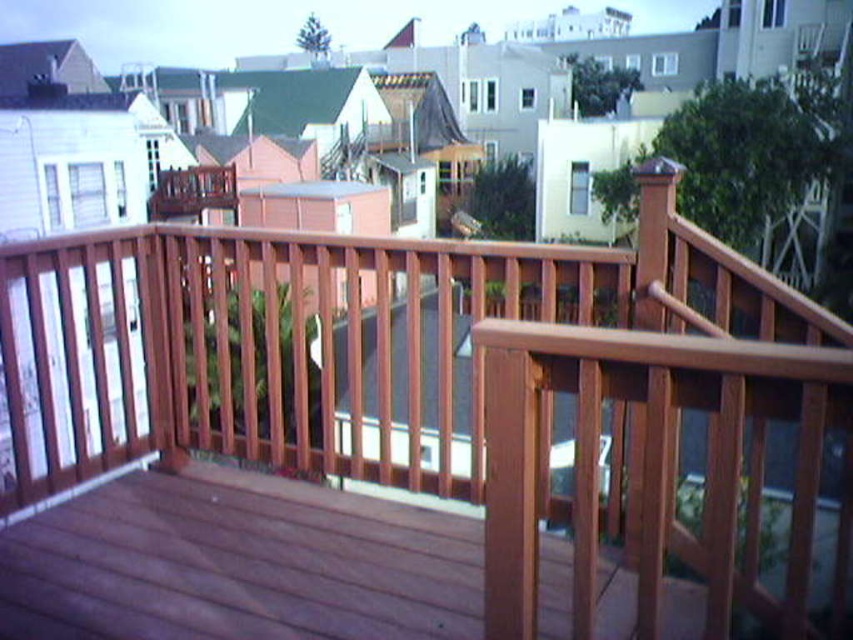
You are standing at the point marked as point (238, 563) on the wooden deck. What is the surface texture like under your feet?

The surface is smooth wood deck at center.